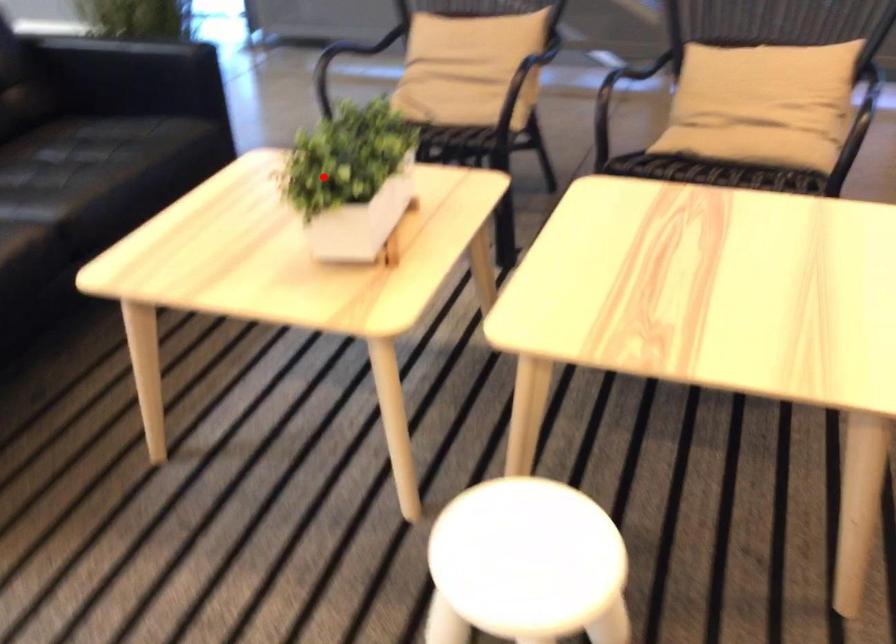
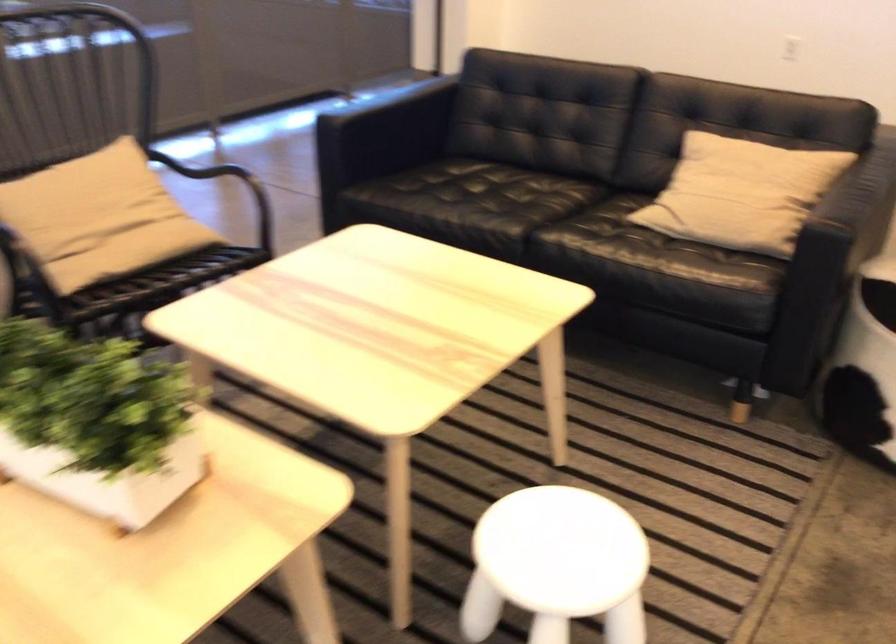
Question: I am providing you with two images of the same scene from different viewpoints. Image1 has a red point marked. In image2, the corresponding 3D location appears at what relative position? Reply with the corresponding letter.

Choices:
 (A) Closer
 (B) Farther

Answer: (A)